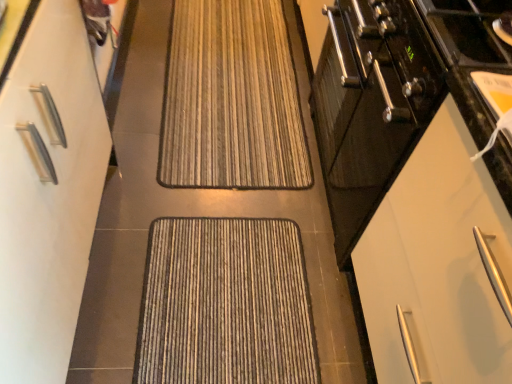
Question: Visually, is brown striped mat at center, arranged as the 1th doormat when viewed from the top, positioned to the left or to the right of textured brown doormat at center, the second doormat positioned from the top?

Choices:
 (A) right
 (B) left

Answer: (B)

Question: Would you say brown striped mat at center, which appears as the first doormat when viewed from the back, is inside or outside textured brown doormat at center, acting as the 2th doormat starting from the back?

Choices:
 (A) inside
 (B) outside

Answer: (B)

Question: Which object is positioned closest to the textured brown doormat at center, which is the first doormat from front to back?

Choices:
 (A) white matte cabinet at right, arranged as the 2th cabinetry when viewed from the left
 (B) brown striped mat at center, which appears as the first doormat when viewed from the back
 (C) white matte cabinet at left, arranged as the 1th cabinetry when viewed from the left

Answer: (C)

Question: Which is nearer to the brown striped mat at center, which appears as the first doormat when viewed from the back?

Choices:
 (A) white matte cabinet at right, the 1th cabinetry from the right
 (B) white matte cabinet at left, arranged as the 1th cabinetry when viewed from the left
 (C) textured brown doormat at center, acting as the 2th doormat starting from the back

Answer: (C)